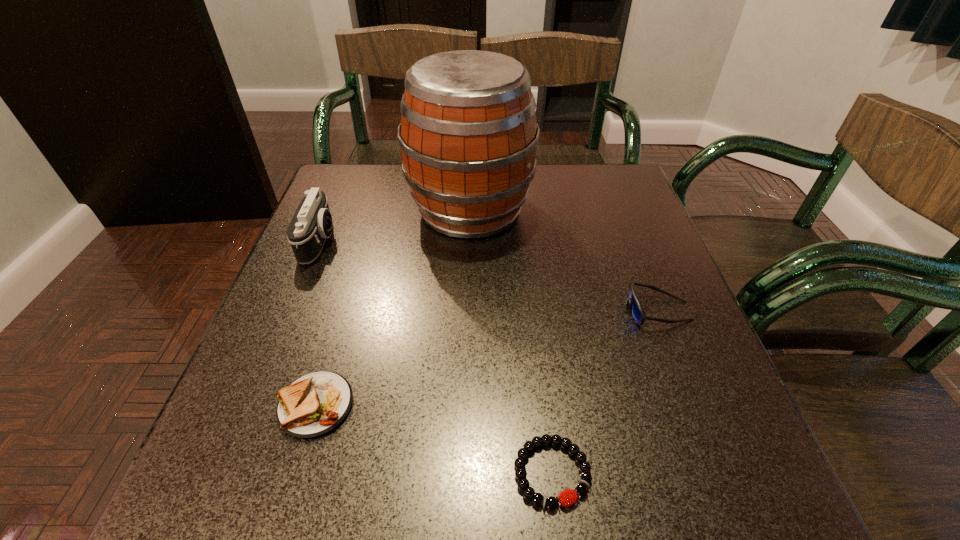
You are a GUI agent. You are given a task and a screenshot of the screen. Output one action in this format:
    pyautogui.click(x=<x>, y=<y>)
    Task: Click on the cider
    This screenshot has height=540, width=960.
    Given the screenshot: What is the action you would take?
    pyautogui.click(x=468, y=134)

Where is `camera`? This screenshot has height=540, width=960. camera is located at coordinates (311, 224).

This screenshot has height=540, width=960. Identify the location of the leftmost object. pyautogui.click(x=311, y=224).

At what (x,y) coordinates should I click in order to perform the action: click on the rightmost object. Please return your answer as a coordinate pair (x, y). Looking at the image, I should click on (636, 311).

This screenshot has width=960, height=540. In order to click on the third nearest object in this screenshot , I will do `click(636, 311)`.

Find the location of `sandwich`. sandwich is located at coordinates (313, 405).

Where is `the second shortest object`? Image resolution: width=960 pixels, height=540 pixels. the second shortest object is located at coordinates (313, 405).

I want to click on bracelet, so click(x=538, y=499).

Find the location of a particular element. vacant space located 0.080m on the left of the tallest object is located at coordinates (376, 210).

Find the location of a particular element. free region located 0.120m on the front lens of the camera is located at coordinates (389, 241).